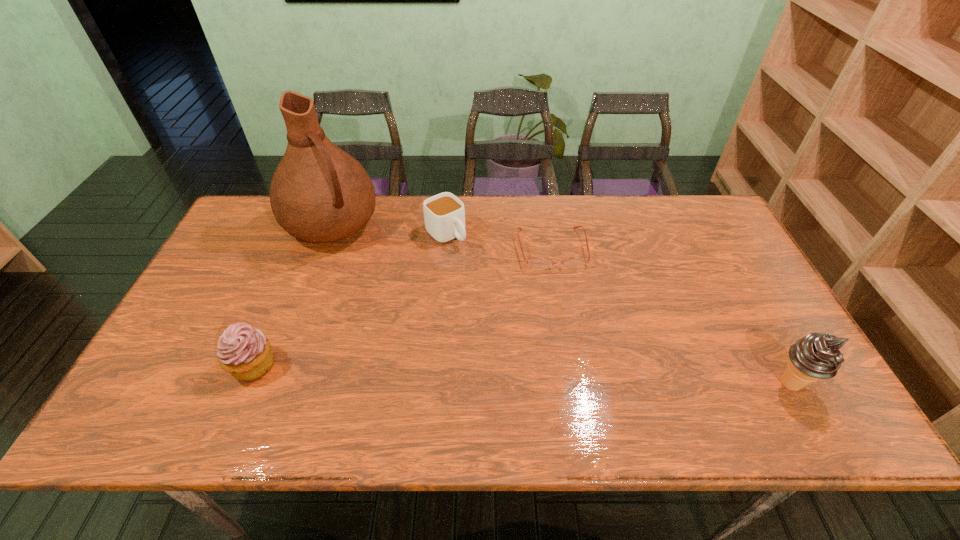
The width and height of the screenshot is (960, 540). I want to click on free spot on the desktop that is between the cupcake and the second tallest object and is positioned on the lenses of the spectacles, so click(581, 376).

The height and width of the screenshot is (540, 960). In order to click on vacant space on the desktop that is between the third shortest object and the rightmost object and is positioned on the side with the handle of the cup in this screenshot , I will do `click(595, 377)`.

At what (x,y) coordinates should I click in order to perform the action: click on free space on the desktop that is between the third tallest object and the icecream and is positioned on the side of the pitcher with the handle. Please return your answer as a coordinate pair (x, y). The image size is (960, 540). Looking at the image, I should click on (447, 372).